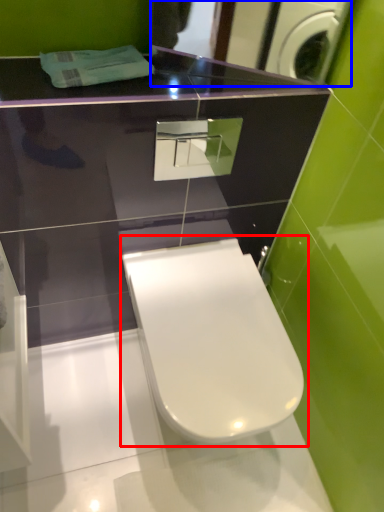
Question: Which object is closer to the camera taking this photo, toilet (highlighted by a red box) or mirror (highlighted by a blue box)?

Choices:
 (A) toilet
 (B) mirror

Answer: (B)